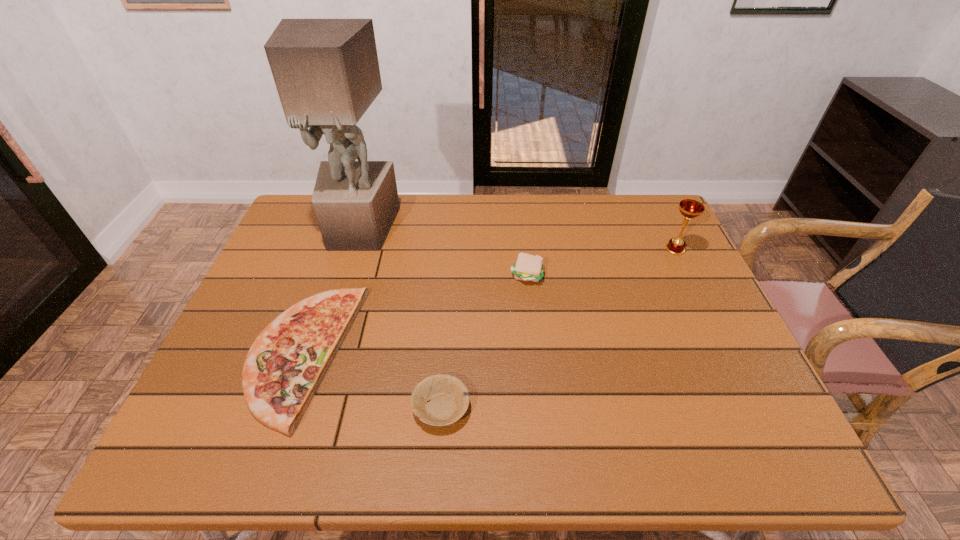
I want to click on object present at the near left corner, so click(286, 363).

This screenshot has width=960, height=540. In the image, there is a desktop. In order to click on vacant space at the far edge in this screenshot , I will do `click(443, 227)`.

Image resolution: width=960 pixels, height=540 pixels. In the image, there is a desktop. What are the coordinates of `vacant space at the near edge` in the screenshot? It's located at (631, 454).

The width and height of the screenshot is (960, 540). Identify the location of blank space at the left edge of the desktop. (269, 273).

Where is `free space at the right edge of the desktop`? free space at the right edge of the desktop is located at coordinates (673, 321).

Find the location of a particular element. vacant area at the far left corner of the desktop is located at coordinates (312, 203).

In the image, there is a desktop. Where is `vacant space at the near left corner`? vacant space at the near left corner is located at coordinates (231, 423).

At what (x,y) coordinates should I click in order to perform the action: click on unoccupied area between the pizza and the patty. Please return your answer as a coordinate pair (x, y). The image size is (960, 540). Looking at the image, I should click on (415, 315).

Image resolution: width=960 pixels, height=540 pixels. I want to click on vacant area between the rightmost object and the bowl, so click(x=558, y=329).

Where is `free point between the sculpture and the fourth shortest object`? The height and width of the screenshot is (540, 960). free point between the sculpture and the fourth shortest object is located at coordinates (517, 239).